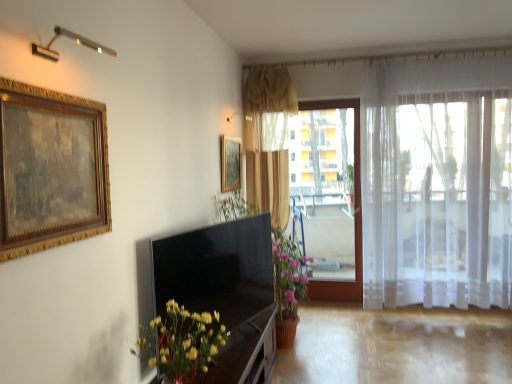
What are the coordinates of `white sheer curtain at right, placed as the 2th curtain when sorted from left to right` in the screenshot? It's located at (437, 182).

What do you see at coordinates (50, 169) in the screenshot?
I see `gold wood picture frame at upper left, marked as the second picture frame in a right-to-left arrangement` at bounding box center [50, 169].

Describe the element at coordinates (230, 164) in the screenshot. I see `gold-framed picture at center, arranged as the 1th picture frame when viewed from the back` at that location.

The height and width of the screenshot is (384, 512). I want to click on matte gold curtain at center, which ranks as the 2th curtain in right-to-left order, so click(x=268, y=140).

The height and width of the screenshot is (384, 512). I want to click on wooden dresser at lower center, so click(245, 354).

From a real-world perspective, is transparent plastic window screen at center above or below gold-framed picture at center, positioned as the first picture frame in right-to-left order?

In terms of real-world spatial position, transparent plastic window screen at center is below gold-framed picture at center, positioned as the first picture frame in right-to-left order.

Measure the distance between transparent plastic window screen at center and gold-framed picture at center, positioned as the first picture frame in right-to-left order.

transparent plastic window screen at center is 3.83 feet from gold-framed picture at center, positioned as the first picture frame in right-to-left order.

Looking at this image, is transparent plastic window screen at center inside or outside of gold-framed picture at center, marked as the 2th picture frame in a left-to-right arrangement?

transparent plastic window screen at center is spatially situated outside gold-framed picture at center, marked as the 2th picture frame in a left-to-right arrangement.

Consider the image. Between transparent plastic window screen at center and gold-framed picture at center, arranged as the 1th picture frame when viewed from the back, which one has larger width?

transparent plastic window screen at center.

Considering the relative positions of yellow matte vase at lower left and transparent plastic window screen at center in the image provided, is yellow matte vase at lower left to the left or to the right of transparent plastic window screen at center?

Based on their positions, yellow matte vase at lower left is located to the left of transparent plastic window screen at center.

What's the angular difference between yellow matte vase at lower left and transparent plastic window screen at center's facing directions?

They differ by 89.7 degrees in their facing directions.

Would you say yellow matte vase at lower left is a long distance from transparent plastic window screen at center?

Yes, yellow matte vase at lower left is far from transparent plastic window screen at center.

At what (x,y) coordinates should I click in order to perform the action: click on flower below the transparent plastic window screen at center (from the image's perspective). Please return your answer as a coordinate pair (x, y). Image resolution: width=512 pixels, height=384 pixels. Looking at the image, I should click on (x=181, y=342).

Can you confirm if yellow matte vase at lower left is positioned to the right of satin black tv at center?

No.

Can we say yellow matte vase at lower left lies outside satin black tv at center?

Absolutely, yellow matte vase at lower left is external to satin black tv at center.

In terms of width, does yellow matte vase at lower left look wider or thinner when compared to satin black tv at center?

yellow matte vase at lower left is wider than satin black tv at center.

Considering the sizes of yellow matte vase at lower left and white sheer curtain at right, acting as the 1th curtain starting from the right, in the image, is yellow matte vase at lower left wider or thinner than white sheer curtain at right, acting as the 1th curtain starting from the right,?

In the image, yellow matte vase at lower left appears to be wider than white sheer curtain at right, acting as the 1th curtain starting from the right.

Based on their positions, is yellow matte vase at lower left located to the left or right of white sheer curtain at right, acting as the 1th curtain starting from the right?

From the image, it's evident that yellow matte vase at lower left is to the left of white sheer curtain at right, acting as the 1th curtain starting from the right.

Consider the image. Considering the relative sizes of yellow matte vase at lower left and white sheer curtain at right, acting as the 1th curtain starting from the right, in the image provided, is yellow matte vase at lower left smaller than white sheer curtain at right, acting as the 1th curtain starting from the right,?

Yes, yellow matte vase at lower left is smaller than white sheer curtain at right, acting as the 1th curtain starting from the right.

How many degrees apart are the facing directions of yellow matte vase at lower left and white sheer curtain at right, placed as the 2th curtain when sorted from left to right?

yellow matte vase at lower left and white sheer curtain at right, placed as the 2th curtain when sorted from left to right, are facing 90 degrees away from each other.

The height and width of the screenshot is (384, 512). In the image, there is a gold-framed picture at center, marked as the 2th picture frame in a left-to-right arrangement. In order to click on flower below it (from the image's perspective) in this screenshot , I will do `click(181, 342)`.

From the image's perspective, between gold-framed picture at center, arranged as the 1th picture frame when viewed from the back, and yellow matte vase at lower left, who is located below?

yellow matte vase at lower left is shown below in the image.

Can you tell me how much gold-framed picture at center, marked as the 2th picture frame in a left-to-right arrangement, and yellow matte vase at lower left differ in facing direction?

The facing directions of gold-framed picture at center, marked as the 2th picture frame in a left-to-right arrangement, and yellow matte vase at lower left are 0.528 degrees apart.

From a real-world perspective, which object rests below the other?

satin black tv at center, from a real-world perspective.

Can you confirm if transparent plastic window screen at center is positioned to the left of satin black tv at center?

In fact, transparent plastic window screen at center is to the right of satin black tv at center.

Is transparent plastic window screen at center smaller than satin black tv at center?

No.

From their relative heights in the image, would you say transparent plastic window screen at center is taller or shorter than satin black tv at center?

Considering their sizes, transparent plastic window screen at center has more height than satin black tv at center.

Is satin black tv at center bigger or smaller than white sheer curtain at right, placed as the 2th curtain when sorted from left to right?

Clearly, satin black tv at center is smaller in size than white sheer curtain at right, placed as the 2th curtain when sorted from left to right.

Is satin black tv at center oriented away from white sheer curtain at right, placed as the 2th curtain when sorted from left to right?

No, satin black tv at center's orientation is not away from white sheer curtain at right, placed as the 2th curtain when sorted from left to right.

Which object is positioned more to the left, satin black tv at center or white sheer curtain at right, placed as the 2th curtain when sorted from left to right?

satin black tv at center.

You are a GUI agent. You are given a task and a screenshot of the screen. Output one action in this format:
    pyautogui.click(x=<x>, y=<y>)
    Task: Click on the window screen below the gold-framed picture at center, arranged as the 1th picture frame when viewed from the back (from a real-world perspective)
    The image size is (512, 384).
    Given the screenshot: What is the action you would take?
    pyautogui.click(x=327, y=184)

Identify the location of window screen that appears above the yellow matte vase at lower left (from a real-world perspective). This screenshot has height=384, width=512. coord(327,184).

Looking at this image, from the image, which object appears to be farther from gold wood picture frame at upper left, which is the first picture frame in left-to-right order, matte gold curtain at center, which ranks as the 2th curtain in right-to-left order, or transparent plastic window screen at center?

The object further to gold wood picture frame at upper left, which is the first picture frame in left-to-right order, is transparent plastic window screen at center.

Estimate the real-world distances between objects in this image. Which object is further from yellow matte vase at lower left, gold wood picture frame at upper left, which is the first picture frame in left-to-right order, or wooden dresser at lower center?

Among the two, gold wood picture frame at upper left, which is the first picture frame in left-to-right order, is located further to yellow matte vase at lower left.

Considering their positions, is matte gold curtain at center, which ranks as the 2th curtain in right-to-left order, positioned closer to satin black tv at center than gold-framed picture at center, positioned as the first picture frame in right-to-left order?

gold-framed picture at center, positioned as the first picture frame in right-to-left order, is closer to satin black tv at center.

Which object lies nearer to the anchor point transparent plastic window screen at center, gold-framed picture at center, acting as the second picture frame starting from the front, or yellow matte vase at lower left?

gold-framed picture at center, acting as the second picture frame starting from the front, is closer to transparent plastic window screen at center.

Which object lies further to the anchor point wooden dresser at lower center, yellow matte vase at lower left or gold wood picture frame at upper left, marked as the second picture frame in a right-to-left arrangement?

gold wood picture frame at upper left, marked as the second picture frame in a right-to-left arrangement.

Which object lies further to the anchor point transparent plastic window screen at center, gold wood picture frame at upper left, the first picture frame from the front, or matte gold curtain at center, which is the first curtain in left-to-right order?

The object further to transparent plastic window screen at center is gold wood picture frame at upper left, the first picture frame from the front.

Which object lies nearer to the anchor point gold-framed picture at center, marked as the 2th picture frame in a left-to-right arrangement, satin black tv at center or yellow matte vase at lower left?

satin black tv at center.

In the scene shown: Based on their spatial positions, is yellow matte vase at lower left or transparent plastic window screen at center further from gold-framed picture at center, acting as the second picture frame starting from the front?

yellow matte vase at lower left.

Image resolution: width=512 pixels, height=384 pixels. What are the coordinates of `flower between gold wood picture frame at upper left, which is the first picture frame in left-to-right order, and gold-framed picture at center, acting as the second picture frame starting from the front, in the front-back direction` in the screenshot? It's located at (181, 342).

At what (x,y) coordinates should I click in order to perform the action: click on dresser located between yellow matte vase at lower left and white sheer curtain at right, placed as the 2th curtain when sorted from left to right, in the left-right direction. Please return your answer as a coordinate pair (x, y). The width and height of the screenshot is (512, 384). Looking at the image, I should click on (245, 354).

Where is `picture frame between yellow matte vase at lower left and matte gold curtain at center, which ranks as the 2th curtain in right-to-left order, along the z-axis`? The height and width of the screenshot is (384, 512). picture frame between yellow matte vase at lower left and matte gold curtain at center, which ranks as the 2th curtain in right-to-left order, along the z-axis is located at coordinates (230, 164).

Where is `picture frame situated between yellow matte vase at lower left and white sheer curtain at right, placed as the 2th curtain when sorted from left to right, from left to right`? picture frame situated between yellow matte vase at lower left and white sheer curtain at right, placed as the 2th curtain when sorted from left to right, from left to right is located at coordinates (230, 164).